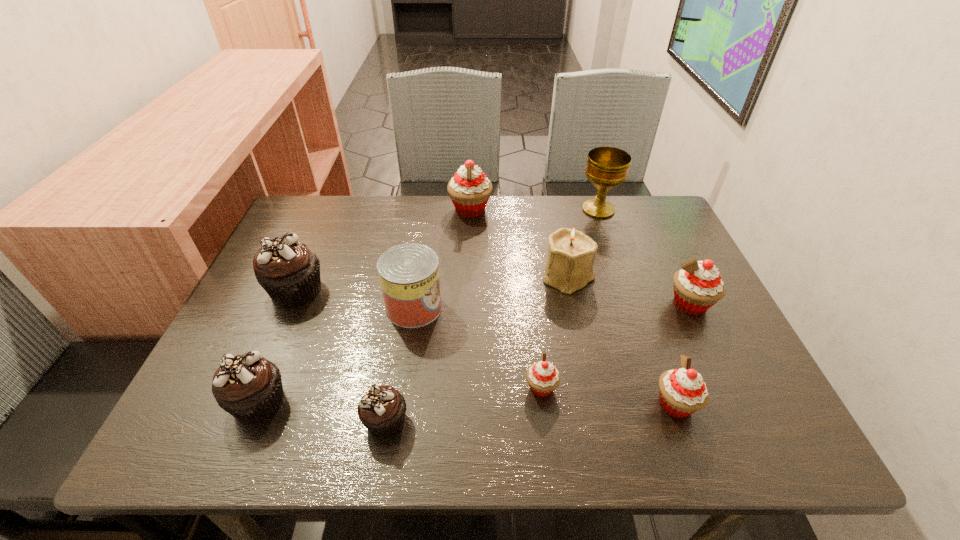
Locate an element on the screen. The height and width of the screenshot is (540, 960). the sixth cupcake from left to right is located at coordinates (682, 391).

The width and height of the screenshot is (960, 540). Find the location of `the second biggest brown cupcake`. the second biggest brown cupcake is located at coordinates (249, 387).

What are the coordinates of `the sixth object from left to right` in the screenshot? It's located at (543, 377).

Locate an element on the screen. The width and height of the screenshot is (960, 540). the smallest pink cupcake is located at coordinates (543, 377).

Locate an element on the screen. The image size is (960, 540). the rightmost brown cupcake is located at coordinates (382, 409).

You are a GUI agent. You are given a task and a screenshot of the screen. Output one action in this format:
    pyautogui.click(x=<x>, y=<y>)
    Task: Click on the smallest brown cupcake
    The height and width of the screenshot is (540, 960).
    Given the screenshot: What is the action you would take?
    pyautogui.click(x=382, y=409)

You are a GUI agent. You are given a task and a screenshot of the screen. Output one action in this format:
    pyautogui.click(x=<x>, y=<y>)
    Task: Click on the vacant region located on the front of the leftmost pink cupcake
    The image size is (960, 540).
    Given the screenshot: What is the action you would take?
    pos(468,279)

You are a GUI agent. You are given a task and a screenshot of the screen. Output one action in this format:
    pyautogui.click(x=<x>, y=<y>)
    Task: Click on the free space located on the right of the chalice
    
    Given the screenshot: What is the action you would take?
    (x=645, y=210)

Find the location of `blank space located on the back of the candle_holder`. blank space located on the back of the candle_holder is located at coordinates click(x=553, y=203).

Where is `free space located on the back of the farthest brown cupcake`? free space located on the back of the farthest brown cupcake is located at coordinates (331, 208).